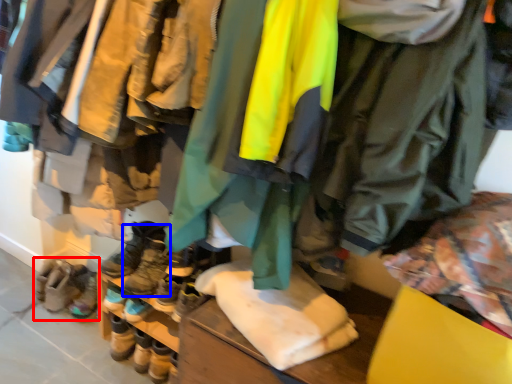
Question: Among these objects, which one is nearest to the camera, footwear (highlighted by a red box) or footwear (highlighted by a blue box)?

Choices:
 (A) footwear
 (B) footwear

Answer: (B)